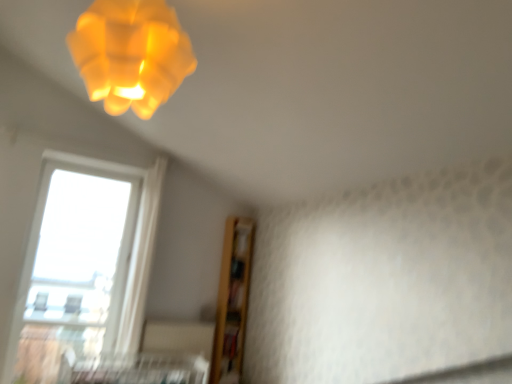
Describe the element at coordinates (83, 264) in the screenshot. This screenshot has height=384, width=512. I see `transparent glass window at lower left` at that location.

Image resolution: width=512 pixels, height=384 pixels. I want to click on transparent glass window at lower left, so click(x=83, y=264).

You are a GUI agent. You are given a task and a screenshot of the screen. Output one action in this format:
    pyautogui.click(x=<x>, y=<y>)
    Task: Click on the lamp located in front of the metallic silver bed frame at lower center
    Image resolution: width=512 pixels, height=384 pixels.
    Given the screenshot: What is the action you would take?
    pyautogui.click(x=131, y=54)

Does metallic silver bed frame at lower center turn towards matte yellow plastic lamp at upper left?

No, metallic silver bed frame at lower center is not turned towards matte yellow plastic lamp at upper left.

Can you tell me how much metallic silver bed frame at lower center and matte yellow plastic lamp at upper left differ in facing direction?

81 degrees separate the facing orientations of metallic silver bed frame at lower center and matte yellow plastic lamp at upper left.

Considering the relative positions of metallic silver bed frame at lower center and matte yellow plastic lamp at upper left in the image provided, is metallic silver bed frame at lower center to the left or to the right of matte yellow plastic lamp at upper left?

Clearly, metallic silver bed frame at lower center is on the left of matte yellow plastic lamp at upper left in the image.

From a real-world perspective, is matte yellow plastic lamp at upper left on transparent glass window at lower left?

Yes, from a real-world perspective, matte yellow plastic lamp at upper left is above transparent glass window at lower left.

Is matte yellow plastic lamp at upper left taller or shorter than transparent glass window at lower left?

In the image, matte yellow plastic lamp at upper left appears to be shorter than transparent glass window at lower left.

Is point (160, 9) positioned after point (55, 172)?

No.

From the image's perspective, which one is positioned higher, matte yellow plastic lamp at upper left or transparent glass window at lower left?

From the image's view, matte yellow plastic lamp at upper left is above.

Considering the positions of point (122, 2) and point (159, 367), is point (122, 2) closer or farther from the camera than point (159, 367)?

Point (122, 2).

From a real-world perspective, is matte yellow plastic lamp at upper left located higher than metallic silver bed frame at lower center?

Yes, from a real-world perspective, matte yellow plastic lamp at upper left is over metallic silver bed frame at lower center

Is matte yellow plastic lamp at upper left aimed at metallic silver bed frame at lower center?

No, matte yellow plastic lamp at upper left does not turn towards metallic silver bed frame at lower center.

Is matte yellow plastic lamp at upper left at the right side of metallic silver bed frame at lower center?

Correct, you'll find matte yellow plastic lamp at upper left to the right of metallic silver bed frame at lower center.

The image size is (512, 384). What are the coordinates of `window on the left of metallic silver bed frame at lower center` in the screenshot? It's located at (83, 264).

Would you say metallic silver bed frame at lower center is inside or outside transparent glass window at lower left?

metallic silver bed frame at lower center cannot be found inside transparent glass window at lower left.

Can you confirm if metallic silver bed frame at lower center is smaller than transparent glass window at lower left?

Correct, metallic silver bed frame at lower center occupies less space than transparent glass window at lower left.

Is transparent glass window at lower left aimed at metallic silver bed frame at lower center?

Yes.

From a real-world perspective, is transparent glass window at lower left under metallic silver bed frame at lower center?

No, from a real-world perspective, transparent glass window at lower left is not beneath metallic silver bed frame at lower center.

Is point (95, 176) farther from camera compared to point (164, 379)?

Yes, point (95, 176) is farther from viewer.

Which object is closer to the camera taking this photo, transparent glass window at lower left or matte yellow plastic lamp at upper left?

matte yellow plastic lamp at upper left is in front.

Is transparent glass window at lower left bigger than matte yellow plastic lamp at upper left?

Correct, transparent glass window at lower left is larger in size than matte yellow plastic lamp at upper left.

From the image's perspective, who appears lower, transparent glass window at lower left or matte yellow plastic lamp at upper left?

From the image's view, transparent glass window at lower left is below.

Does transparent glass window at lower left appear on the right side of matte yellow plastic lamp at upper left?

In fact, transparent glass window at lower left is to the left of matte yellow plastic lamp at upper left.

Find the location of a particular element. The image size is (512, 384). lamp that is on the right side of metallic silver bed frame at lower center is located at coordinates (131, 54).

Find the location of a particular element. The image size is (512, 384). lamp in front of the transparent glass window at lower left is located at coordinates (131, 54).

From the image, which object appears to be nearer to metallic silver bed frame at lower center, matte yellow plastic lamp at upper left or transparent glass window at lower left?

Based on the image, transparent glass window at lower left appears to be nearer to metallic silver bed frame at lower center.

Which object lies nearer to the anchor point transparent glass window at lower left, metallic silver bed frame at lower center or matte yellow plastic lamp at upper left?

The object closer to transparent glass window at lower left is metallic silver bed frame at lower center.

Which object lies nearer to the anchor point metallic silver bed frame at lower center, transparent glass window at lower left or matte yellow plastic lamp at upper left?

The object closer to metallic silver bed frame at lower center is transparent glass window at lower left.

Which object lies nearer to the anchor point matte yellow plastic lamp at upper left, transparent glass window at lower left or metallic silver bed frame at lower center?

transparent glass window at lower left is positioned closer to the anchor matte yellow plastic lamp at upper left.

Considering their positions, is metallic silver bed frame at lower center positioned closer to matte yellow plastic lamp at upper left than transparent glass window at lower left?

Based on the image, transparent glass window at lower left appears to be nearer to matte yellow plastic lamp at upper left.

Based on their spatial positions, is matte yellow plastic lamp at upper left or metallic silver bed frame at lower center closer to transparent glass window at lower left?

metallic silver bed frame at lower center lies closer to transparent glass window at lower left than the other object.

The height and width of the screenshot is (384, 512). Find the location of `bed frame between matte yellow plastic lamp at upper left and transparent glass window at lower left along the z-axis`. bed frame between matte yellow plastic lamp at upper left and transparent glass window at lower left along the z-axis is located at coordinates (132, 369).